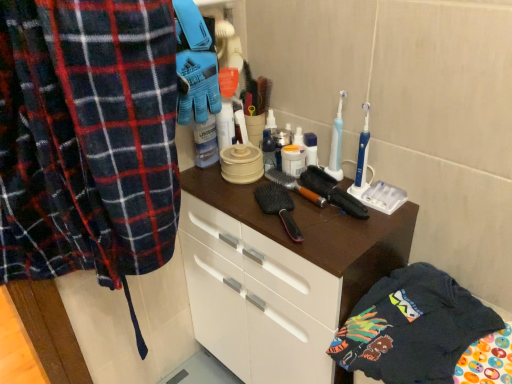
Question: From a real-world perspective, is black rubber brush at center, the 1th brush when ordered from right to left, below brown wooden brush at center, arranged as the 1th brush when viewed from the left?

Choices:
 (A) yes
 (B) no

Answer: (B)

Question: Does black rubber brush at center, the 2th brush when ordered from left to right, have a greater width compared to brown wooden brush at center, the 2th brush from the right?

Choices:
 (A) no
 (B) yes

Answer: (B)

Question: Does black rubber brush at center, the 2th brush when ordered from left to right, have a larger size compared to brown wooden brush at center, arranged as the 1th brush when viewed from the left?

Choices:
 (A) no
 (B) yes

Answer: (B)

Question: Is the position of black rubber brush at center, the 2th brush when ordered from left to right, more distant than that of brown wooden brush at center, the 2th brush from the right?

Choices:
 (A) no
 (B) yes

Answer: (A)

Question: From a real-world perspective, is black rubber brush at center, the 1th brush when ordered from right to left, on top of brown wooden brush at center, arranged as the 1th brush when viewed from the left?

Choices:
 (A) no
 (B) yes

Answer: (B)

Question: Does point (283, 178) appear closer or farther from the camera than point (207, 215)?

Choices:
 (A) farther
 (B) closer

Answer: (B)

Question: Choose the correct answer: Is brown wooden brush at center, arranged as the 1th brush when viewed from the left, inside brown matte cabinet at center or outside it?

Choices:
 (A) outside
 (B) inside

Answer: (A)

Question: Is brown wooden brush at center, the 2th brush from the right, wider or thinner than brown matte cabinet at center?

Choices:
 (A) thin
 (B) wide

Answer: (A)

Question: From a real-world perspective, is brown wooden brush at center, arranged as the 1th brush when viewed from the left, positioned above or below brown matte cabinet at center?

Choices:
 (A) above
 (B) below

Answer: (A)

Question: Is dark blue cotton t-shirt at lower right inside the boundaries of brown wooden brush at center, the 2th brush from the right, or outside?

Choices:
 (A) inside
 (B) outside

Answer: (B)

Question: From a real-world perspective, relative to brown wooden brush at center, arranged as the 1th brush when viewed from the left, is dark blue cotton t-shirt at lower right vertically above or below?

Choices:
 (A) below
 (B) above

Answer: (A)

Question: Is dark blue cotton t-shirt at lower right to the left or to the right of brown wooden brush at center, arranged as the 1th brush when viewed from the left, in the image?

Choices:
 (A) left
 (B) right

Answer: (B)

Question: From their relative heights in the image, would you say dark blue cotton t-shirt at lower right is taller or shorter than brown wooden brush at center, the 2th brush from the right?

Choices:
 (A) tall
 (B) short

Answer: (A)

Question: From a real-world perspective, is black rubber brush at center, the 2th brush when ordered from left to right, positioned above or below brown matte cabinet at center?

Choices:
 (A) above
 (B) below

Answer: (A)

Question: Do you think black rubber brush at center, the 1th brush when ordered from right to left, is within brown matte cabinet at center, or outside of it?

Choices:
 (A) inside
 (B) outside

Answer: (B)